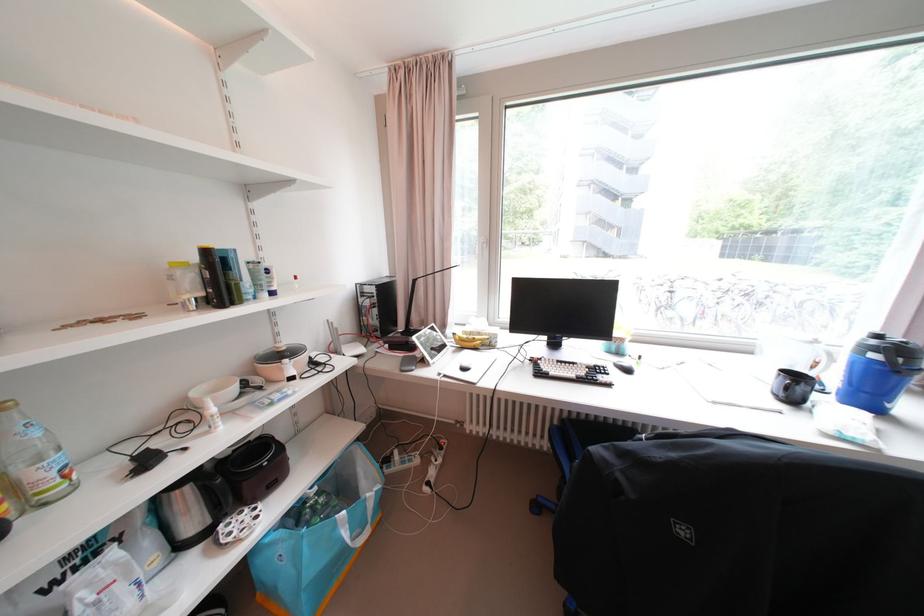
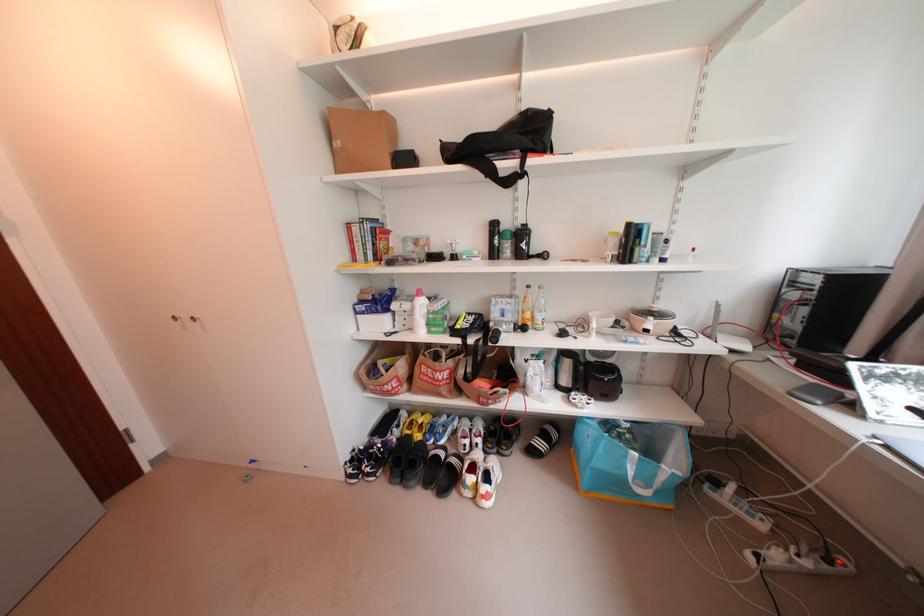
Locate, in the second image, the point that corresponds to point (395, 469) in the first image.

(719, 490)